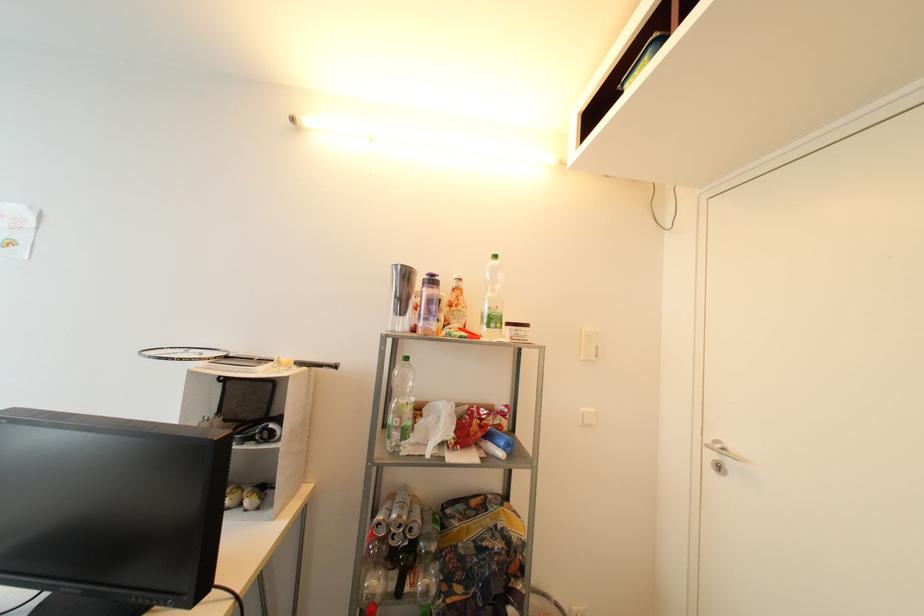
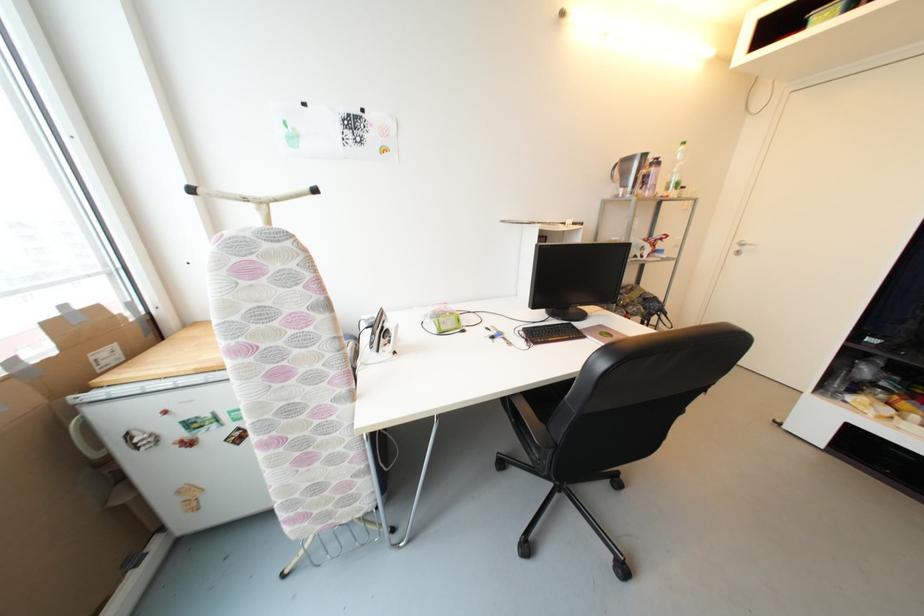
Question: I am providing you with two images of the same scene from different viewpoints. Please identify which objects are invisible in image2.

Choices:
 (A) green pump dispenser head
 (B) white electric iron
 (C) plastic water bottle
 (D) badminton racket

Answer: (D)